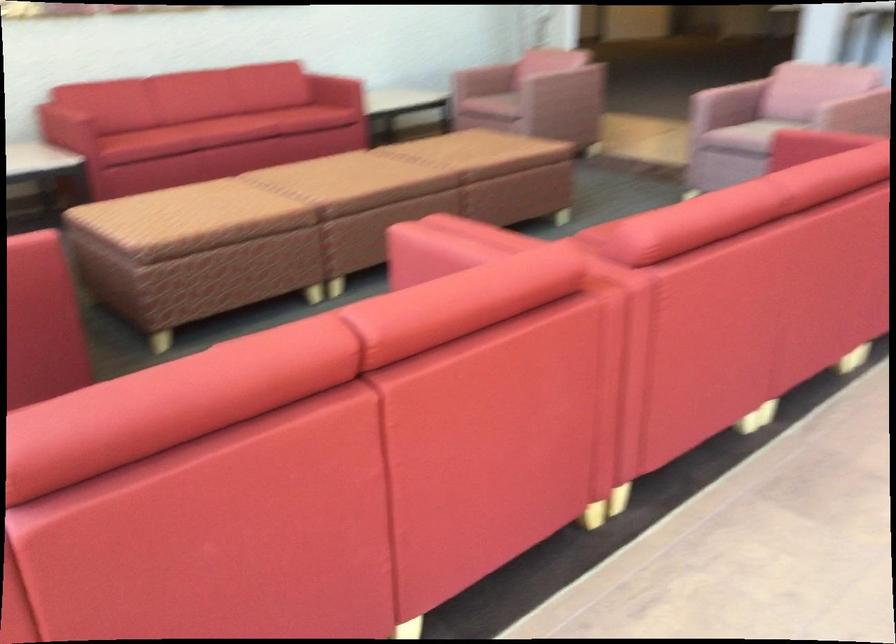
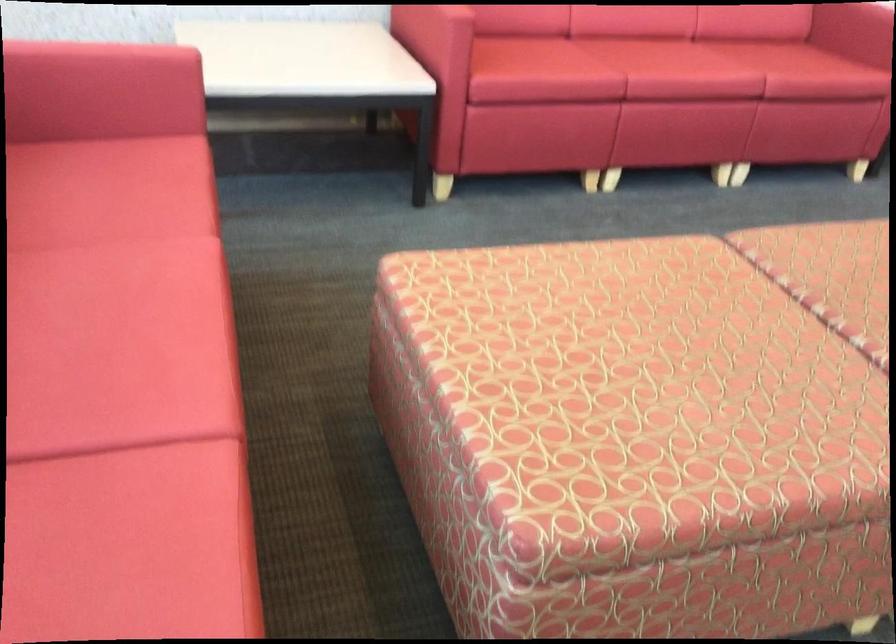
Consider the image. What movement of the cameraman would produce the second image?

The cameraman moved toward left, forward.